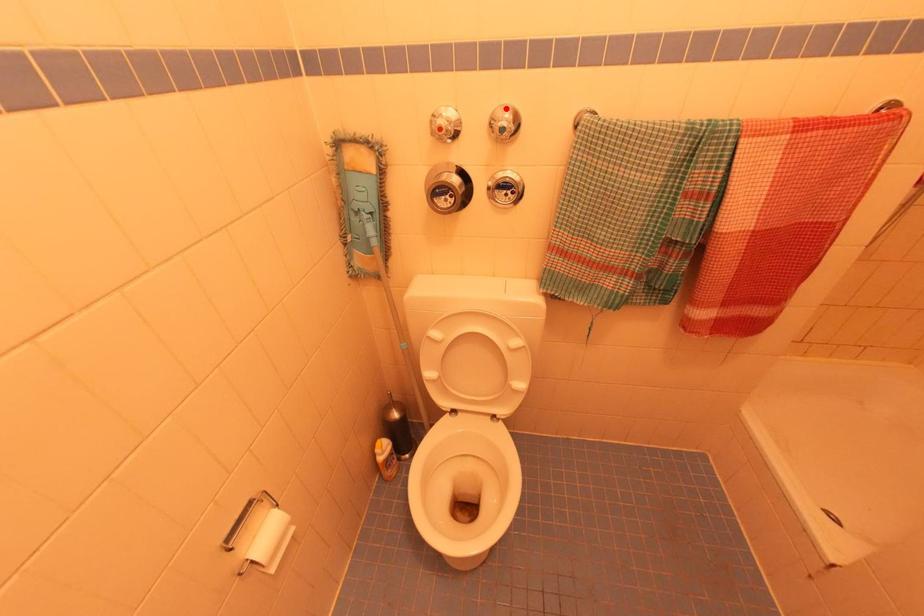
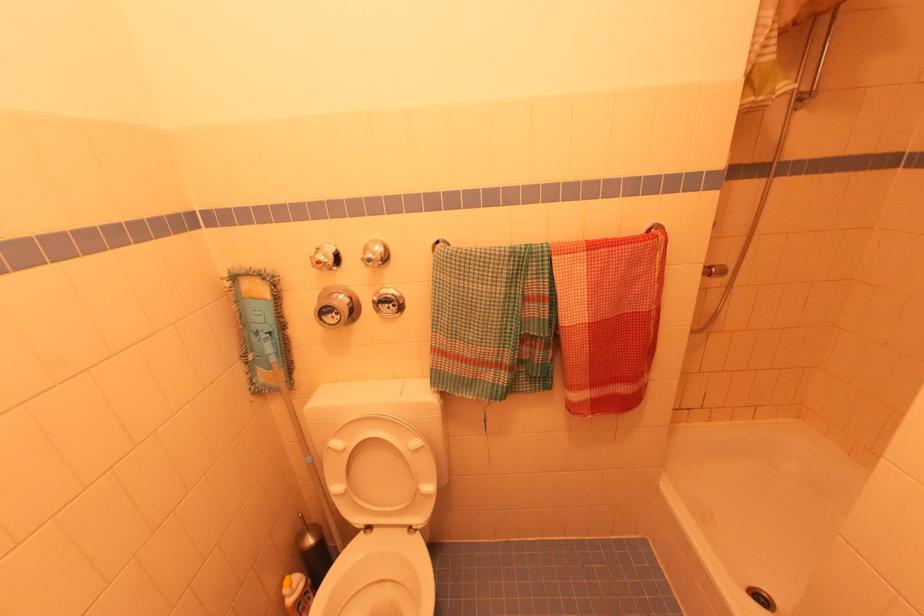
Question: I am providing you with two images of the same scene from different viewpoints. A red point is marked on the first image. At the location where the point appears in image 1, is it still visible in image 2?

Choices:
 (A) Yes
 (B) No

Answer: (A)